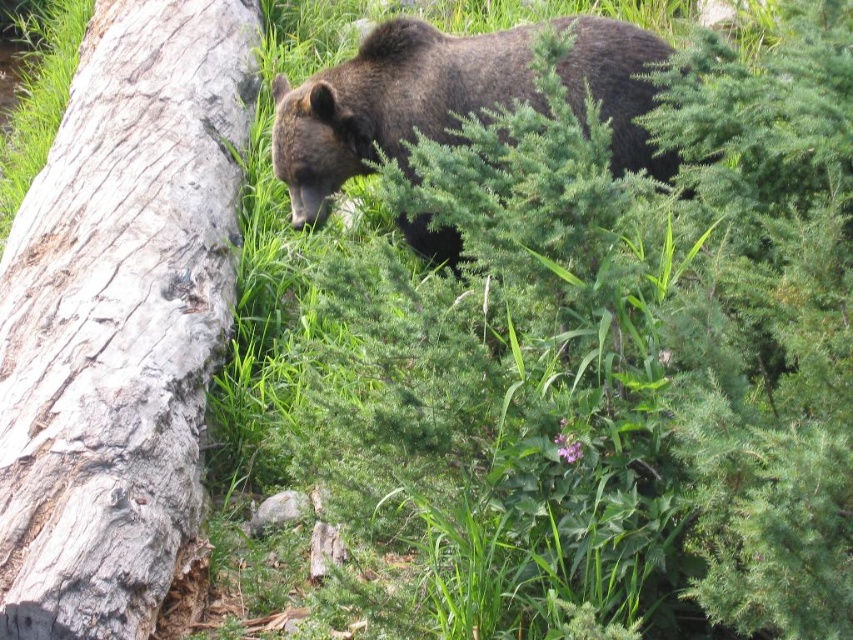
Question: Does gray rough bark tree trunk at left appear on the left side of dark brown fur bear at center?

Choices:
 (A) no
 (B) yes

Answer: (B)

Question: Can you confirm if gray rough bark tree trunk at left is positioned below dark brown fur bear at center?

Choices:
 (A) no
 (B) yes

Answer: (B)

Question: Among these points, which one is farthest from the camera?

Choices:
 (A) click(x=206, y=243)
 (B) click(x=479, y=44)

Answer: (A)

Question: Which point is closer to the camera taking this photo?

Choices:
 (A) (433, 45)
 (B) (73, 396)

Answer: (B)

Question: Is gray rough bark tree trunk at left to the right of dark brown fur bear at center from the viewer's perspective?

Choices:
 (A) no
 (B) yes

Answer: (A)